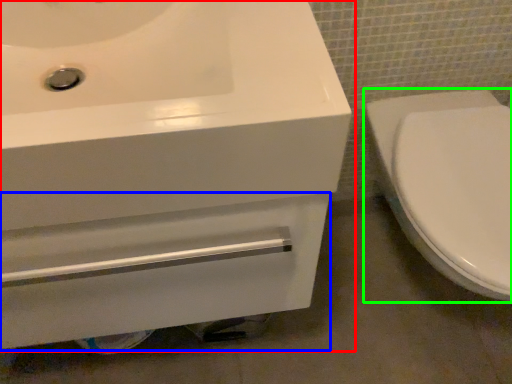
Question: Which is farther away from sink (highlighted by a red box)? drawer (highlighted by a blue box) or toilet (highlighted by a green box)?

Choices:
 (A) drawer
 (B) toilet

Answer: (B)